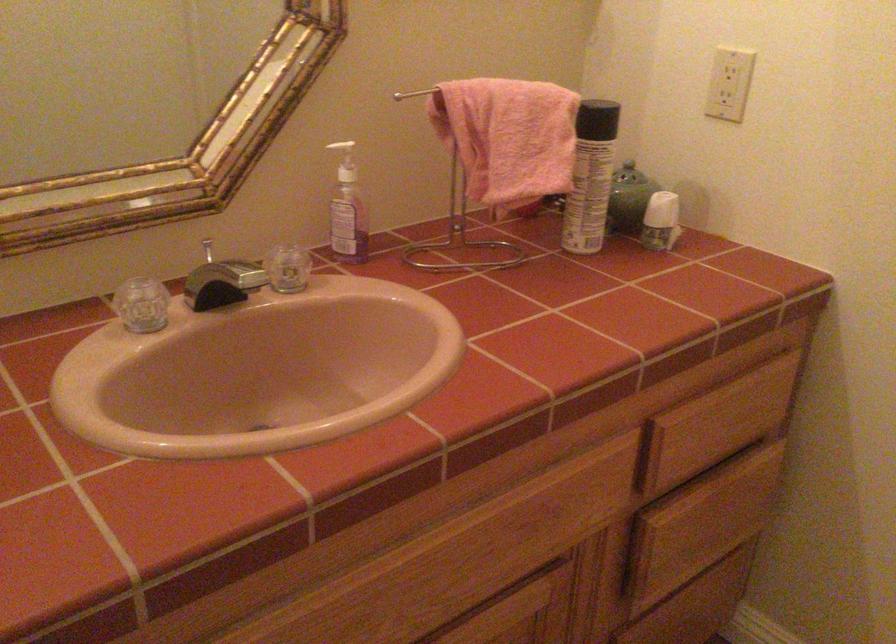
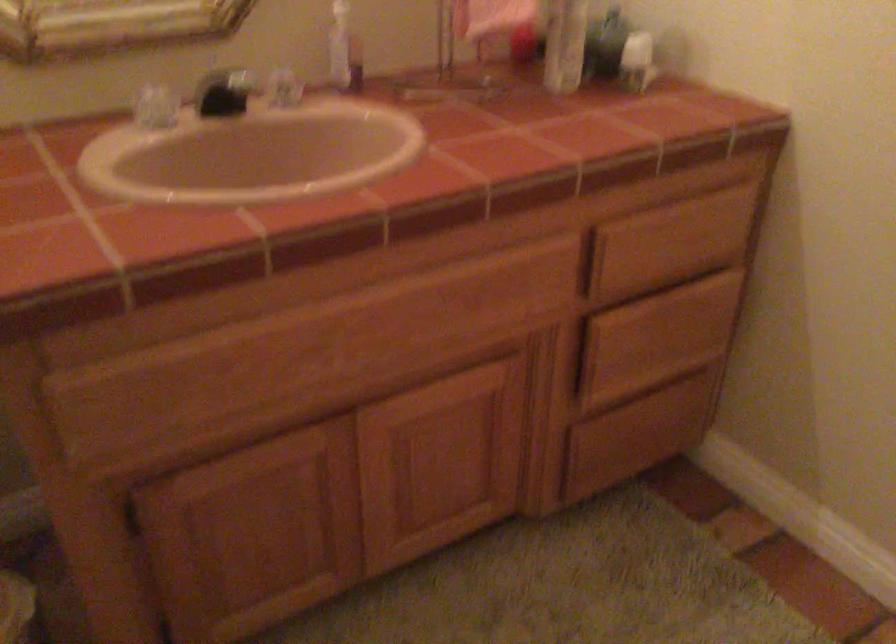
The point at (233,297) is marked in the first image. Where is the corresponding point in the second image?

(225, 91)